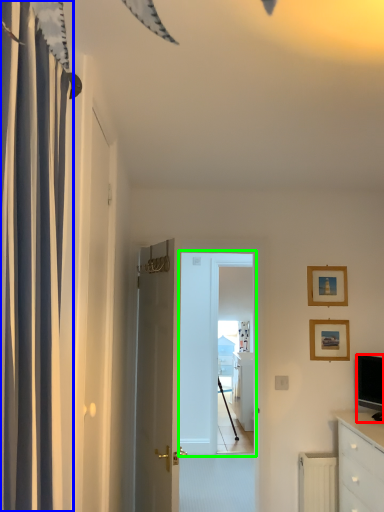
Question: Estimate the real-world distances between objects in this image. Which object is closer to television (highlighted by a red box), curtain (highlighted by a blue box) or screen door (highlighted by a green box)?

Choices:
 (A) curtain
 (B) screen door

Answer: (B)